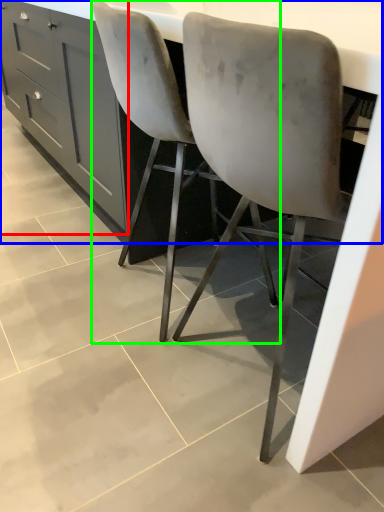
Question: Which object is the farthest from cabinetry (highlighted by a red box)? Choose among these: counter (highlighted by a blue box) or chair (highlighted by a green box).

Choices:
 (A) counter
 (B) chair

Answer: (A)